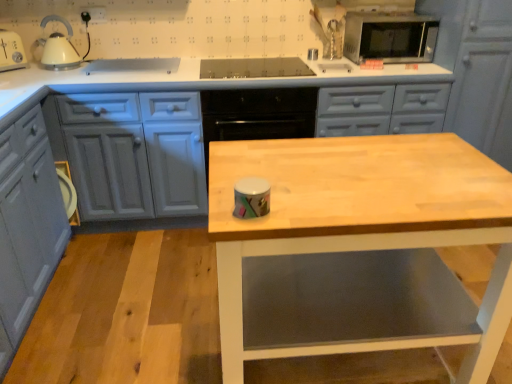
At what (x,y) coordinates should I click in order to perform the action: click on vacant space situated above wooden table at center (from a real-world perspective). Please return your answer as a coordinate pair (x, y). This screenshot has height=384, width=512. Looking at the image, I should click on (362, 173).